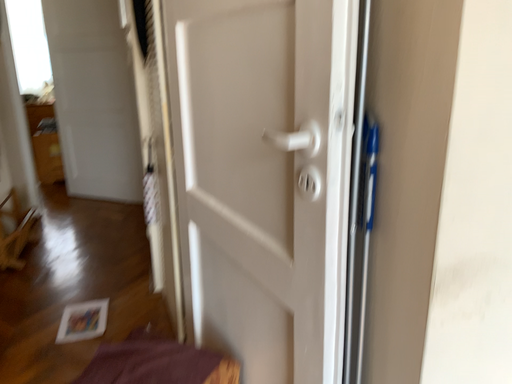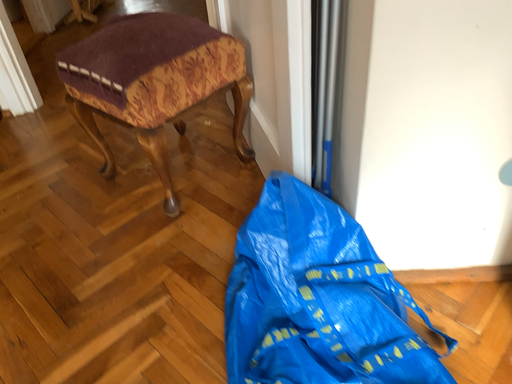
Question: How did the camera likely rotate when shooting the video?

Choices:
 (A) rotated downward
 (B) rotated upward

Answer: (A)